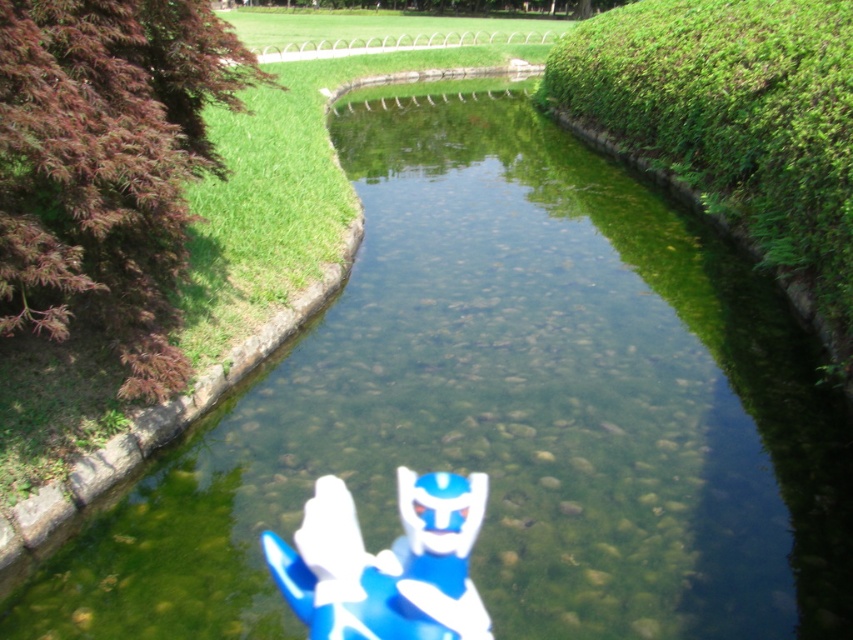
Question: Among these points, which one is farthest from the camera?

Choices:
 (A) (73, 284)
 (B) (844, 67)
 (C) (432, 566)

Answer: (B)

Question: Which is farther from the purple leafy hedge at left?

Choices:
 (A) green leafy hedge at right
 (B) blue plastic toy at center

Answer: (A)

Question: Which point appears farthest from the camera in this image?

Choices:
 (A) (838, 196)
 (B) (480, 618)
 (C) (161, 387)

Answer: (A)

Question: Can you confirm if green leafy hedge at right is positioned below blue plastic toy at center?

Choices:
 (A) yes
 (B) no

Answer: (B)

Question: Is purple leafy hedge at left to the right of green leafy hedge at right from the viewer's perspective?

Choices:
 (A) yes
 (B) no

Answer: (B)

Question: Can you confirm if purple leafy hedge at left is positioned below blue plastic toy at center?

Choices:
 (A) yes
 (B) no

Answer: (B)